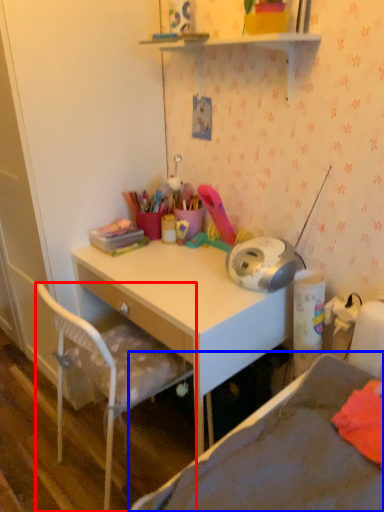
Question: Which point is closer to the camera, chair (highlighted by a red box) or bed (highlighted by a blue box)?

Choices:
 (A) chair
 (B) bed

Answer: (B)